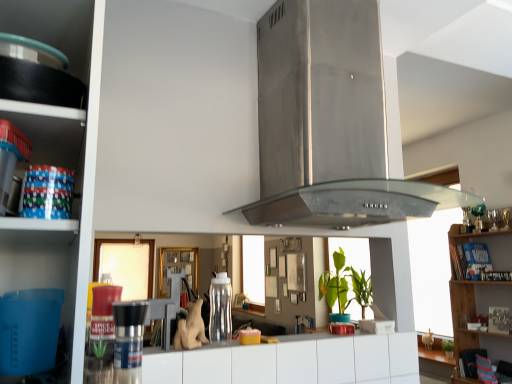
Question: From a real-world perspective, is brushed metal pepper grinder at center, acting as the second appliance starting from the back, on matte black pan at left, which ranks as the 1th shelf in top-to-bottom order?

Choices:
 (A) no
 (B) yes

Answer: (A)

Question: Is brushed metal pepper grinder at center, the first appliance positioned from the left, turned away from matte black pan at left, arranged as the first shelf when viewed from the front?

Choices:
 (A) no
 (B) yes

Answer: (A)

Question: Does brushed metal pepper grinder at center, the first appliance positioned from the left, turn towards matte black pan at left, which ranks as the 1th shelf in top-to-bottom order?

Choices:
 (A) yes
 (B) no

Answer: (B)

Question: Is brushed metal pepper grinder at center, acting as the second appliance starting from the back, thinner than matte black pan at left, the 3th shelf from the back?

Choices:
 (A) no
 (B) yes

Answer: (B)

Question: Is brushed metal pepper grinder at center, acting as the second appliance starting from the back, positioned behind matte black pan at left, the 3th shelf from the back?

Choices:
 (A) yes
 (B) no

Answer: (A)

Question: From the image's perspective, is clear plastic water bottle at center, arranged as the 1th appliance when viewed from the right, positioned above or below brushed metal pepper grinder at center, acting as the first appliance starting from the front?

Choices:
 (A) below
 (B) above

Answer: (A)

Question: In terms of height, does clear plastic water bottle at center, arranged as the 1th appliance when viewed from the right, look taller or shorter compared to brushed metal pepper grinder at center, acting as the first appliance starting from the front?

Choices:
 (A) short
 (B) tall

Answer: (B)

Question: Would you say clear plastic water bottle at center, the 1th appliance from the back, is inside or outside brushed metal pepper grinder at center, acting as the second appliance starting from the back?

Choices:
 (A) inside
 (B) outside

Answer: (B)

Question: Considering the positions of clear plastic water bottle at center, arranged as the 1th appliance when viewed from the right, and brushed metal pepper grinder at center, the first appliance positioned from the left, in the image, is clear plastic water bottle at center, arranged as the 1th appliance when viewed from the right, wider or thinner than brushed metal pepper grinder at center, the first appliance positioned from the left,?

Choices:
 (A) thin
 (B) wide

Answer: (B)

Question: From the image's perspective, is wooden bookshelf at right, arranged as the 3th shelf when viewed from the front, positioned above or below matte black pan at left, the 3th shelf from the back?

Choices:
 (A) below
 (B) above

Answer: (A)

Question: Relative to matte black pan at left, the third shelf ordered from the bottom, is wooden bookshelf at right, marked as the 3th shelf in a top-to-bottom arrangement, in front or behind?

Choices:
 (A) front
 (B) behind

Answer: (B)

Question: Looking at their shapes, would you say wooden bookshelf at right, marked as the 3th shelf in a top-to-bottom arrangement, is wider or thinner than matte black pan at left, arranged as the first shelf when viewed from the front?

Choices:
 (A) thin
 (B) wide

Answer: (B)

Question: Would you say wooden bookshelf at right, acting as the 1th shelf starting from the right, is to the left or to the right of matte black pan at left, the 3th shelf from the back, in the picture?

Choices:
 (A) right
 (B) left

Answer: (A)

Question: Choose the correct answer: Is brushed metal pepper grinder at center, which is the second appliance in right-to-left order, inside white matte drawer at center or outside it?

Choices:
 (A) inside
 (B) outside

Answer: (B)

Question: Is brushed metal pepper grinder at center, which is the second appliance in right-to-left order, to the left or to the right of white matte drawer at center in the image?

Choices:
 (A) right
 (B) left

Answer: (B)